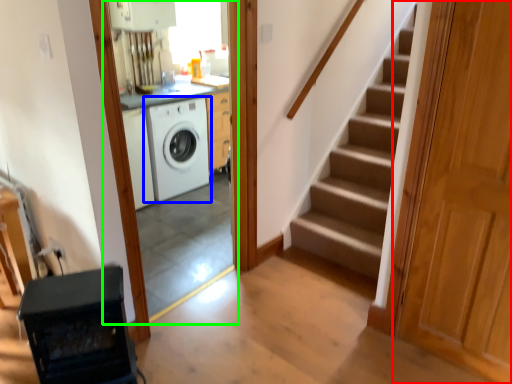
Question: Considering the real-world distances, which object is farthest from door (highlighted by a red box)? washing machine (highlighted by a blue box) or screen door (highlighted by a green box)?

Choices:
 (A) washing machine
 (B) screen door

Answer: (A)